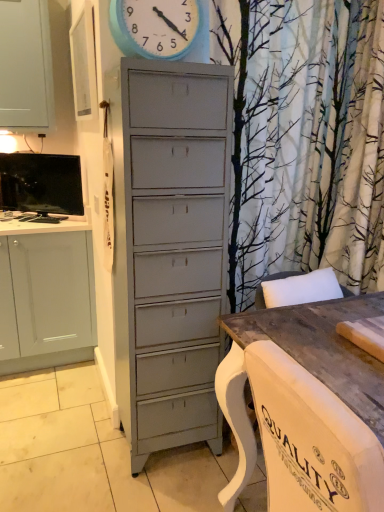
Question: From a real-world perspective, is matte black tv at upper left below wooden table at lower right?

Choices:
 (A) no
 (B) yes

Answer: (A)

Question: Is matte black tv at upper left next to wooden table at lower right and touching it?

Choices:
 (A) no
 (B) yes

Answer: (A)

Question: From the image's perspective, is matte black tv at upper left located beneath wooden table at lower right?

Choices:
 (A) yes
 (B) no

Answer: (B)

Question: Can you confirm if matte black tv at upper left is thinner than wooden table at lower right?

Choices:
 (A) no
 (B) yes

Answer: (B)

Question: Does matte black tv at upper left have a lesser height compared to wooden table at lower right?

Choices:
 (A) no
 (B) yes

Answer: (B)

Question: Does matte black tv at upper left appear on the left side of wooden table at lower right?

Choices:
 (A) yes
 (B) no

Answer: (A)

Question: Does wooden table at lower right lie in front of matte black tv at upper left?

Choices:
 (A) yes
 (B) no

Answer: (A)

Question: Does wooden table at lower right have a smaller size compared to matte black tv at upper left?

Choices:
 (A) no
 (B) yes

Answer: (A)

Question: Could you tell me if wooden table at lower right is turned towards matte black tv at upper left?

Choices:
 (A) yes
 (B) no

Answer: (B)

Question: Does wooden table at lower right have a larger size compared to matte black tv at upper left?

Choices:
 (A) yes
 (B) no

Answer: (A)

Question: Can you confirm if wooden table at lower right is positioned to the right of matte black tv at upper left?

Choices:
 (A) yes
 (B) no

Answer: (A)

Question: Does wooden table at lower right have a lesser width compared to matte black tv at upper left?

Choices:
 (A) yes
 (B) no

Answer: (B)

Question: From a real-world perspective, is matte black tv at upper left positioned over blue painted wood clock at upper center based on gravity?

Choices:
 (A) yes
 (B) no

Answer: (B)